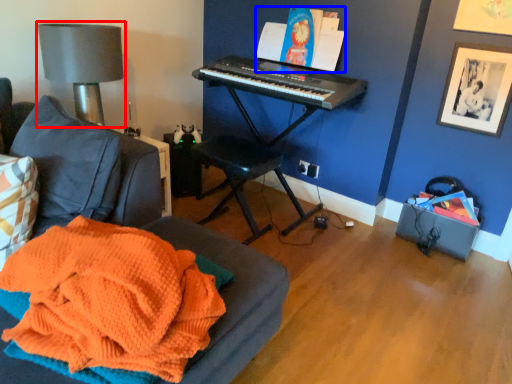
Question: Which point is further to the camera, table lamp (highlighted by a red box) or book (highlighted by a blue box)?

Choices:
 (A) table lamp
 (B) book

Answer: (B)